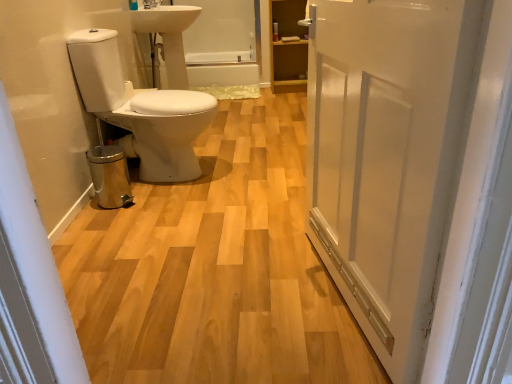
Question: From a real-world perspective, does white glossy bathtub at center stand above white glossy sink at upper center?

Choices:
 (A) yes
 (B) no

Answer: (B)

Question: Is white glossy sink at upper center a part of white glossy bathtub at center?

Choices:
 (A) yes
 (B) no

Answer: (B)

Question: Does white glossy bathtub at center have a smaller size compared to white glossy sink at upper center?

Choices:
 (A) no
 (B) yes

Answer: (B)

Question: Is white glossy bathtub at center to the right of white glossy sink at upper center from the viewer's perspective?

Choices:
 (A) no
 (B) yes

Answer: (B)

Question: Is white glossy bathtub at center taller than white glossy sink at upper center?

Choices:
 (A) no
 (B) yes

Answer: (A)

Question: From a real-world perspective, is white glossy bathtub at center above or below wooden cabinet at upper right?

Choices:
 (A) above
 (B) below

Answer: (B)

Question: Is white glossy bathtub at center wider or thinner than wooden cabinet at upper right?

Choices:
 (A) thin
 (B) wide

Answer: (B)

Question: Does point (247, 77) appear closer or farther from the camera than point (292, 77)?

Choices:
 (A) farther
 (B) closer

Answer: (A)

Question: Do you think white glossy bathtub at center is within wooden cabinet at upper right, or outside of it?

Choices:
 (A) inside
 (B) outside

Answer: (B)

Question: From the image's perspective, is white glossy sink at upper center above or below white glossy toilet at left?

Choices:
 (A) below
 (B) above

Answer: (B)

Question: From a real-world perspective, is white glossy sink at upper center physically located above or below white glossy toilet at left?

Choices:
 (A) above
 (B) below

Answer: (A)

Question: Considering their positions, is white glossy sink at upper center located in front of or behind white glossy toilet at left?

Choices:
 (A) behind
 (B) front

Answer: (A)

Question: Is white glossy sink at upper center wider or thinner than white glossy toilet at left?

Choices:
 (A) thin
 (B) wide

Answer: (A)

Question: Do you think white matte door at center is within glossy ceramic tap at upper center, or outside of it?

Choices:
 (A) inside
 (B) outside

Answer: (B)

Question: From a real-world perspective, relative to glossy ceramic tap at upper center, is white matte door at center vertically above or below?

Choices:
 (A) below
 (B) above

Answer: (A)